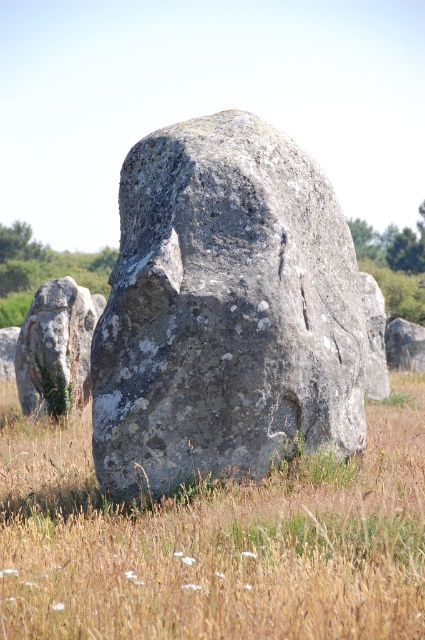
Question: Does gray rough stone at center appear on the right side of gray stone at center?

Choices:
 (A) yes
 (B) no

Answer: (A)

Question: Which object is closer to the camera taking this photo?

Choices:
 (A) gray rough stone at center
 (B) smooth gray rock at left
 (C) gray stone at center

Answer: (C)

Question: Considering the real-world distances, which object is farthest from the gray rough stone at center?

Choices:
 (A) smooth gray rock at left
 (B) gray stone at center

Answer: (A)

Question: Which point is farther from the camera taking this photo?

Choices:
 (A) (175, 576)
 (B) (266, 376)

Answer: (B)

Question: Does gray rough stone at center appear on the left side of smooth gray rock at left?

Choices:
 (A) no
 (B) yes

Answer: (A)

Question: Observing the image, what is the correct spatial positioning of gray stone at center in reference to smooth gray rock at left?

Choices:
 (A) left
 (B) right

Answer: (B)